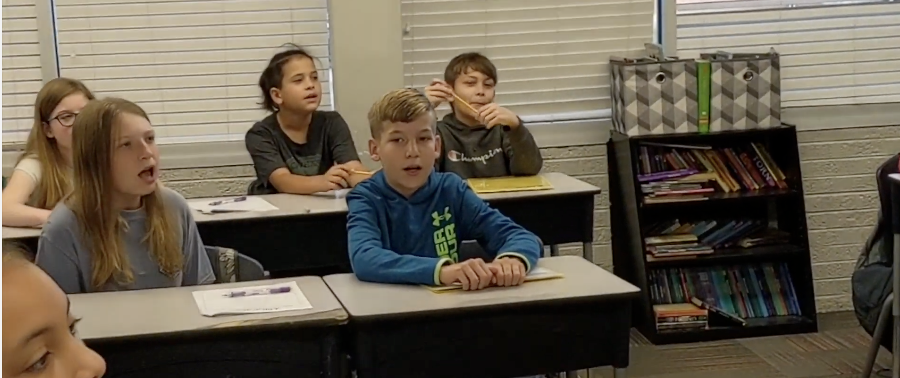
The height and width of the screenshot is (378, 900). Find the location of `white painted brick wall`. white painted brick wall is located at coordinates (843, 193).